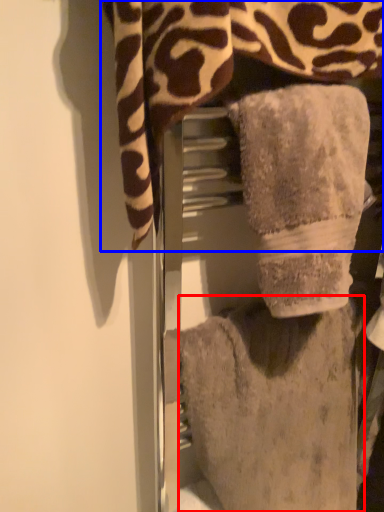
Question: Among these objects, which one is nearest to the camera, towel (highlighted by a red box) or towel (highlighted by a blue box)?

Choices:
 (A) towel
 (B) towel

Answer: (B)